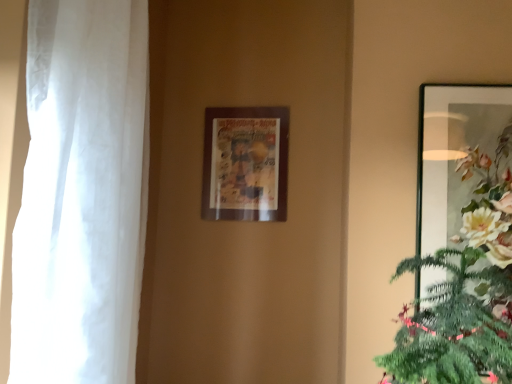
Question: From a real-world perspective, is white sheer curtain at left on top of wooden picture frame at center, positioned as the 1th picture frame in back-to-front order?

Choices:
 (A) yes
 (B) no

Answer: (B)

Question: Is white sheer curtain at left further to the viewer compared to wooden picture frame at center, which is the 2th picture frame from front to back?

Choices:
 (A) no
 (B) yes

Answer: (A)

Question: Would you say white sheer curtain at left is outside wooden picture frame at center, the 1th picture frame when ordered from left to right?

Choices:
 (A) no
 (B) yes

Answer: (B)

Question: Considering the relative sizes of white sheer curtain at left and wooden picture frame at center, which is the 2th picture frame from front to back, in the image provided, is white sheer curtain at left bigger than wooden picture frame at center, which is the 2th picture frame from front to back,?

Choices:
 (A) yes
 (B) no

Answer: (A)

Question: Considering the relative sizes of white sheer curtain at left and wooden picture frame at center, which is the 2th picture frame from right to left, in the image provided, is white sheer curtain at left smaller than wooden picture frame at center, which is the 2th picture frame from right to left,?

Choices:
 (A) yes
 (B) no

Answer: (B)

Question: From the image's perspective, does white sheer curtain at left appear lower than wooden picture frame at center, which is the 2th picture frame from right to left?

Choices:
 (A) yes
 (B) no

Answer: (A)

Question: Is metallic silver picture frame at right, which is the first picture frame from right to left, positioned with its back to wooden picture frame at center, the 1th picture frame when ordered from left to right?

Choices:
 (A) no
 (B) yes

Answer: (A)

Question: Considering the relative positions of metallic silver picture frame at right, which appears as the second picture frame when viewed from the left, and wooden picture frame at center, which is the 2th picture frame from right to left, in the image provided, is metallic silver picture frame at right, which appears as the second picture frame when viewed from the left, to the right of wooden picture frame at center, which is the 2th picture frame from right to left, from the viewer's perspective?

Choices:
 (A) yes
 (B) no

Answer: (A)

Question: From a real-world perspective, is metallic silver picture frame at right, which ranks as the 1th picture frame in front-to-back order, physically below wooden picture frame at center, the 1th picture frame when ordered from left to right?

Choices:
 (A) yes
 (B) no

Answer: (A)

Question: Would you say metallic silver picture frame at right, which is the first picture frame from right to left, is outside wooden picture frame at center, the 1th picture frame when ordered from left to right?

Choices:
 (A) no
 (B) yes

Answer: (B)

Question: Would you say metallic silver picture frame at right, which appears as the second picture frame when viewed from the left, contains wooden picture frame at center, which is the 2th picture frame from front to back?

Choices:
 (A) no
 (B) yes

Answer: (A)

Question: Does metallic silver picture frame at right, which ranks as the 1th picture frame in front-to-back order, have a greater height compared to wooden picture frame at center, which is the 2th picture frame from right to left?

Choices:
 (A) no
 (B) yes

Answer: (B)

Question: Is white sheer curtain at left not near metallic silver picture frame at right, the second picture frame from the back?

Choices:
 (A) yes
 (B) no

Answer: (B)